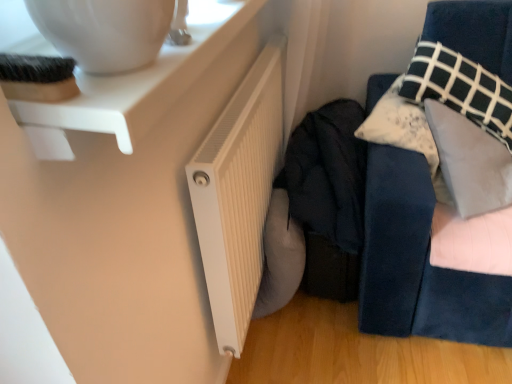
Question: Is white ribbed radiator at lower center looking in the opposite direction of velvet blue sofa at right?

Choices:
 (A) no
 (B) yes

Answer: (B)

Question: Is white ribbed radiator at lower center wider than velvet blue sofa at right?

Choices:
 (A) yes
 (B) no

Answer: (B)

Question: Is white ribbed radiator at lower center positioned in front of velvet blue sofa at right?

Choices:
 (A) no
 (B) yes

Answer: (B)

Question: Can you confirm if white ribbed radiator at lower center is shorter than velvet blue sofa at right?

Choices:
 (A) no
 (B) yes

Answer: (A)

Question: Is white ribbed radiator at lower center completely or partially outside of velvet blue sofa at right?

Choices:
 (A) no
 (B) yes

Answer: (B)

Question: Considering the positions of white plastic table at upper left and velvet blue sofa at right in the image, is white plastic table at upper left wider or thinner than velvet blue sofa at right?

Choices:
 (A) wide
 (B) thin

Answer: (B)

Question: Visually, is white plastic table at upper left positioned to the left or to the right of velvet blue sofa at right?

Choices:
 (A) right
 (B) left

Answer: (B)

Question: Does point (x=209, y=41) appear closer or farther from the camera than point (x=477, y=336)?

Choices:
 (A) closer
 (B) farther

Answer: (A)

Question: Relative to velvet blue sofa at right, is white plastic table at upper left in front or behind?

Choices:
 (A) behind
 (B) front

Answer: (B)

Question: From the image's perspective, is dark fabric jacket at center located above or below velvet blue sofa at right?

Choices:
 (A) above
 (B) below

Answer: (B)

Question: Do you think dark fabric jacket at center is within velvet blue sofa at right, or outside of it?

Choices:
 (A) outside
 (B) inside

Answer: (A)

Question: Looking at the image, does dark fabric jacket at center seem bigger or smaller compared to velvet blue sofa at right?

Choices:
 (A) small
 (B) big

Answer: (B)

Question: Is dark fabric jacket at center wider or thinner than velvet blue sofa at right?

Choices:
 (A) thin
 (B) wide

Answer: (B)

Question: Would you say white ribbed radiator at lower center is to the left or to the right of dark fabric jacket at center in the picture?

Choices:
 (A) right
 (B) left

Answer: (B)

Question: From a real-world perspective, is white ribbed radiator at lower center positioned above or below dark fabric jacket at center?

Choices:
 (A) below
 (B) above

Answer: (B)